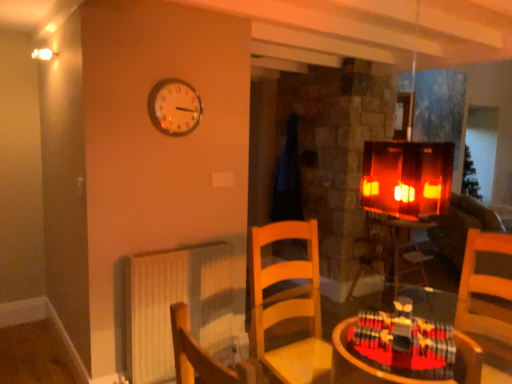
Identify the location of wooden table at center, the 2th table when ordered from left to right. This screenshot has width=512, height=384. (391, 252).

Locate an element on the screen. wall clock above the velvet brown couch at right (from a real-world perspective) is located at coordinates (174, 107).

Does metallic round clock at upper center have a smaller size compared to velvet brown couch at right?

Indeed, metallic round clock at upper center has a smaller size compared to velvet brown couch at right.

Are metallic round clock at upper center and velvet brown couch at right beside each other?

metallic round clock at upper center and velvet brown couch at right are clearly separated.

In the image, is metallic round clock at upper center positioned in front of or behind velvet brown couch at right?

metallic round clock at upper center is in front of velvet brown couch at right.

Does wooden table at lower right, which is counted as the first table, starting from the front, come behind wooden table at center, marked as the 1th table in a bottom-to-top arrangement?

That is False.

From the image's perspective, which one is positioned higher, wooden table at lower right, the 2th table in the bottom-to-top sequence, or wooden table at center, placed as the 2th table when sorted from front to back?

wooden table at lower right, the 2th table in the bottom-to-top sequence, appears higher in the image.

Considering the positions of point (470, 352) and point (385, 279), is point (470, 352) closer or farther from the camera than point (385, 279)?

Clearly, point (470, 352) is closer to the camera than point (385, 279).

Is velvet brown couch at right beside wooden table at lower right, which is counted as the first table, starting from the front?

There is a gap between velvet brown couch at right and wooden table at lower right, which is counted as the first table, starting from the front.

Which is more to the left, velvet brown couch at right or wooden table at lower right, which is counted as the first table, starting from the front?

wooden table at lower right, which is counted as the first table, starting from the front, is more to the left.

From the image's perspective, is velvet brown couch at right over wooden table at lower right, which is the second table in back-to-front order?

Actually, velvet brown couch at right appears below wooden table at lower right, which is the second table in back-to-front order, in the image.

Can you confirm if white textured radiator at lower left is shorter than metallic round clock at upper center?

No, white textured radiator at lower left is not shorter than metallic round clock at upper center.

Is white textured radiator at lower left placed right next to metallic round clock at upper center?

No.

Is white textured radiator at lower left completely or partially outside of metallic round clock at upper center?

Indeed, white textured radiator at lower left is completely outside metallic round clock at upper center.

In the image, is white textured radiator at lower left positioned in front of or behind velvet brown couch at right?

white textured radiator at lower left is in front of velvet brown couch at right.

From the image's perspective, is white textured radiator at lower left located beneath velvet brown couch at right?

Correct, white textured radiator at lower left appears lower than velvet brown couch at right in the image.

Are white textured radiator at lower left and velvet brown couch at right making contact?

white textured radiator at lower left and velvet brown couch at right are not in contact.

Which object is positioned more to the right, white textured radiator at lower left or velvet brown couch at right?

Positioned to the right is velvet brown couch at right.

Is wooden table at lower right, which is counted as the first table, starting from the front, aimed at metallic round clock at upper center?

No, wooden table at lower right, which is counted as the first table, starting from the front, is not facing towards metallic round clock at upper center.

Is wooden table at lower right, acting as the 1th table starting from the top, smaller than metallic round clock at upper center?

No.

Would you say metallic round clock at upper center is part of wooden table at lower right, acting as the 1th table starting from the top,'s contents?

No, metallic round clock at upper center is not inside wooden table at lower right, acting as the 1th table starting from the top.

From the image's perspective, is wooden table at lower right, the 2th table in the bottom-to-top sequence, on metallic round clock at upper center?

Incorrect, from the image's perspective, wooden table at lower right, the 2th table in the bottom-to-top sequence, is lower than metallic round clock at upper center.

Is wooden table at center, which is counted as the 1th table, starting from the back, located outside wooden table at lower right, acting as the 1th table starting from the top?

Indeed, wooden table at center, which is counted as the 1th table, starting from the back, is completely outside wooden table at lower right, acting as the 1th table starting from the top.

Considering the relative positions of wooden table at center, which is counted as the 1th table, starting from the back, and wooden table at lower right, acting as the 1th table starting from the top, in the image provided, is wooden table at center, which is counted as the 1th table, starting from the back, to the left or to the right of wooden table at lower right, acting as the 1th table starting from the top,?

Clearly, wooden table at center, which is counted as the 1th table, starting from the back, is on the right of wooden table at lower right, acting as the 1th table starting from the top, in the image.

Is wooden table at center, acting as the first table starting from the right, aimed at wooden table at lower right, acting as the 1th table starting from the top?

No, wooden table at center, acting as the first table starting from the right, does not turn towards wooden table at lower right, acting as the 1th table starting from the top.

Locate an element on the screen. This screenshot has width=512, height=384. table above the wooden table at center, which is counted as the 1th table, starting from the back (from a real-world perspective) is located at coordinates (362, 364).

This screenshot has height=384, width=512. What are the coordinates of `couch below the metallic round clock at upper center (from a real-world perspective)` in the screenshot? It's located at (462, 226).

At what (x,y) coordinates should I click in order to perform the action: click on table behind the wooden table at lower right, the 2th table in the bottom-to-top sequence. Please return your answer as a coordinate pair (x, y). Image resolution: width=512 pixels, height=384 pixels. Looking at the image, I should click on coord(391,252).

Looking at the image, which one is located further to wooden table at center, which is counted as the 1th table, starting from the back, wooden table at lower right, the 2th table in the bottom-to-top sequence, or velvet brown couch at right?

The object further to wooden table at center, which is counted as the 1th table, starting from the back, is wooden table at lower right, the 2th table in the bottom-to-top sequence.

Looking at the image, which one is located closer to wooden table at lower right, which appears as the first table when viewed from the left, velvet brown couch at right or metallic round clock at upper center?

metallic round clock at upper center is closer to wooden table at lower right, which appears as the first table when viewed from the left.

Considering their positions, is metallic round clock at upper center positioned closer to velvet brown couch at right than white textured radiator at lower left?

white textured radiator at lower left is positioned closer to the anchor velvet brown couch at right.

Estimate the real-world distances between objects in this image. Which object is further from white textured radiator at lower left, velvet brown couch at right or metallic round clock at upper center?

velvet brown couch at right.

Looking at the image, which one is located further to white textured radiator at lower left, wooden table at center, the 2th table when ordered from left to right, or wooden table at lower right, the second table viewed from the right?

The object further to white textured radiator at lower left is wooden table at center, the 2th table when ordered from left to right.

From the image, which object appears to be farther from wooden table at center, placed as the 2th table when sorted from front to back, white textured radiator at lower left or wooden table at lower right, which is the second table in back-to-front order?

Based on the image, wooden table at lower right, which is the second table in back-to-front order, appears to be further to wooden table at center, placed as the 2th table when sorted from front to back.

When comparing their distances from velvet brown couch at right, does white textured radiator at lower left or metallic round clock at upper center seem closer?

Based on the image, white textured radiator at lower left appears to be nearer to velvet brown couch at right.

Looking at the image, which one is located further to velvet brown couch at right, metallic round clock at upper center or wooden table at center, marked as the 1th table in a bottom-to-top arrangement?

Among the two, metallic round clock at upper center is located further to velvet brown couch at right.

This screenshot has height=384, width=512. I want to click on wall clock between wooden table at lower right, the 2th table in the bottom-to-top sequence, and wooden table at center, marked as the 1th table in a bottom-to-top arrangement, along the z-axis, so click(x=174, y=107).

This screenshot has height=384, width=512. I want to click on radiator positioned between wooden table at lower right, which appears as the first table when viewed from the left, and wooden table at center, marked as the 1th table in a bottom-to-top arrangement, from near to far, so click(x=176, y=302).

The width and height of the screenshot is (512, 384). I want to click on radiator located between metallic round clock at upper center and wooden table at center, marked as the 1th table in a bottom-to-top arrangement, in the left-right direction, so click(176, 302).

Locate an element on the screen. This screenshot has width=512, height=384. radiator located between metallic round clock at upper center and velvet brown couch at right in the left-right direction is located at coordinates (176, 302).